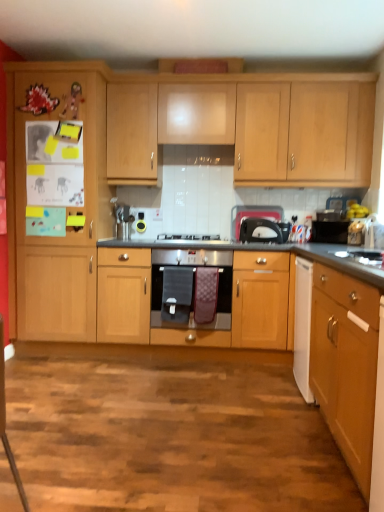
Question: Is white glossy sink at right at the back of satin silver gas stove at center?

Choices:
 (A) no
 (B) yes

Answer: (A)

Question: From the image's perspective, is satin silver gas stove at center on top of white glossy sink at right?

Choices:
 (A) no
 (B) yes

Answer: (B)

Question: Is satin silver gas stove at center thinner than white glossy sink at right?

Choices:
 (A) yes
 (B) no

Answer: (B)

Question: From the image's perspective, is satin silver gas stove at center located beneath white glossy sink at right?

Choices:
 (A) no
 (B) yes

Answer: (A)

Question: Is satin silver gas stove at center located outside white glossy sink at right?

Choices:
 (A) no
 (B) yes

Answer: (B)

Question: Is satin silver gas stove at center far from white glossy sink at right?

Choices:
 (A) yes
 (B) no

Answer: (A)

Question: From a real-world perspective, is wooden cabinet at left, which is counted as the third cabinetry, starting from the front, over satin silver gas stove at center?

Choices:
 (A) yes
 (B) no

Answer: (A)

Question: Is wooden cabinet at left, the 2th cabinetry in the back-to-front sequence, oriented towards satin silver gas stove at center?

Choices:
 (A) yes
 (B) no

Answer: (B)

Question: Is wooden cabinet at left, which is counted as the third cabinetry, starting from the front, at the left side of satin silver gas stove at center?

Choices:
 (A) yes
 (B) no

Answer: (A)

Question: Is wooden cabinet at left, which is counted as the third cabinetry, starting from the front, positioned far away from satin silver gas stove at center?

Choices:
 (A) no
 (B) yes

Answer: (A)

Question: Is wooden cabinet at left, which is counted as the third cabinetry, starting from the front, not inside satin silver gas stove at center?

Choices:
 (A) yes
 (B) no

Answer: (A)

Question: Is the position of wooden cabinet at left, the 2th cabinetry in the back-to-front sequence, less distant than that of satin silver gas stove at center?

Choices:
 (A) yes
 (B) no

Answer: (A)

Question: Is wooden cabinet at left, which is counted as the third cabinetry, starting from the front, not inside wooden cabinet at center, acting as the 3th cabinetry starting from the back?

Choices:
 (A) yes
 (B) no

Answer: (A)